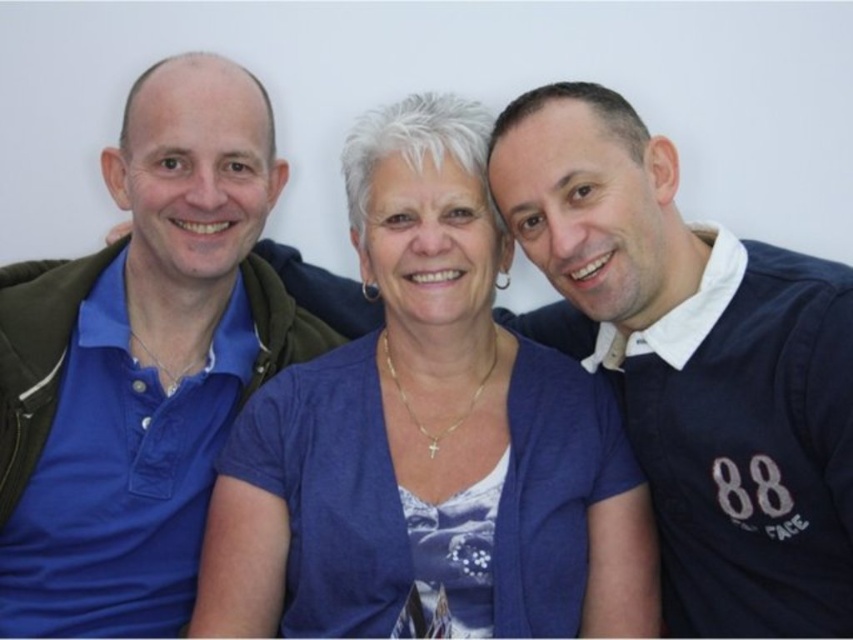
Does blue fabric shirt at center lie behind navy blue jersey at right?

Yes.

Measure the distance from blue fabric shirt at center to navy blue jersey at right.

blue fabric shirt at center and navy blue jersey at right are 23.69 centimeters apart from each other.

What do you see at coordinates (428, 438) in the screenshot? The image size is (853, 640). I see `blue fabric shirt at center` at bounding box center [428, 438].

Image resolution: width=853 pixels, height=640 pixels. In order to click on blue fabric shirt at center in this screenshot , I will do `click(428, 438)`.

Which is behind, point (643, 589) or point (48, 461)?

Positioned behind is point (48, 461).

Measure the distance between blue fabric shirt at center and blue cotton polo shirt at left.

blue fabric shirt at center is 11.46 inches away from blue cotton polo shirt at left.

Who is more distant from viewer, [648,636] or [107,188]?

The point [107,188] is behind.

The height and width of the screenshot is (640, 853). What are the coordinates of `blue fabric shirt at center` in the screenshot? It's located at coord(428,438).

Is point (811, 337) more distant than point (190, 483)?

No, it is not.

Between point (547, 177) and point (300, 308), which one is positioned behind?

Positioned behind is point (300, 308).

In order to click on navy blue jersey at right in this screenshot , I will do `click(694, 364)`.

At what (x,y) coordinates should I click in order to perform the action: click on navy blue jersey at right. Please return your answer as a coordinate pair (x, y). Looking at the image, I should click on (694, 364).